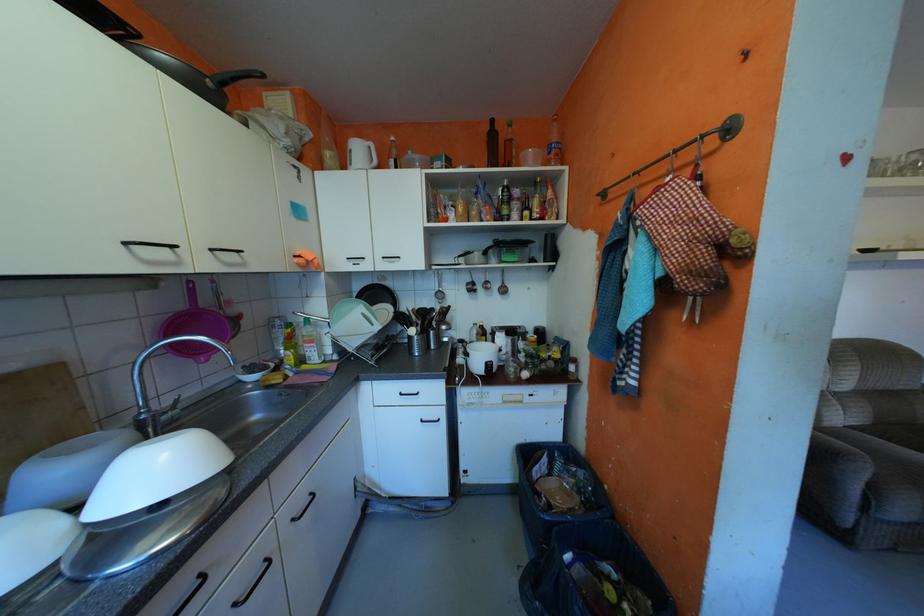
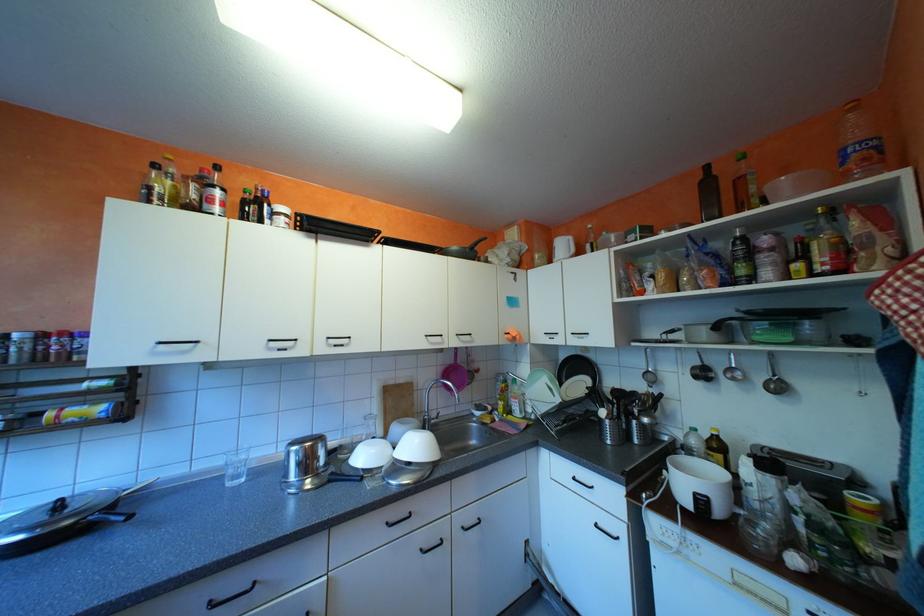
Find the pixel in the second image that matches (x=138, y=432) in the first image.

(428, 422)